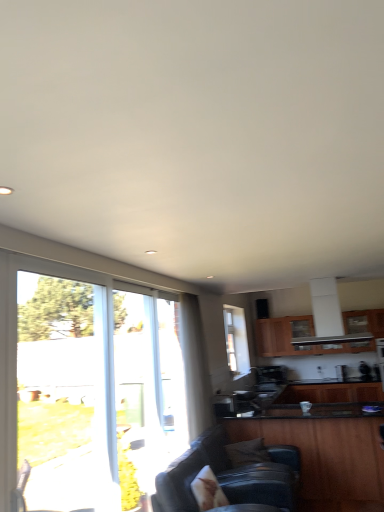
Question: From a real-world perspective, is clear glass window at left, acting as the 1th window starting from the front, below wooden cabinet at upper center, the first cabinetry viewed from the back?

Choices:
 (A) no
 (B) yes

Answer: (B)

Question: From the image's perspective, would you say clear glass window at left, placed as the 2th window when sorted from right to left, is shown under wooden cabinet at upper center, which is the third cabinetry from front to back?

Choices:
 (A) yes
 (B) no

Answer: (B)

Question: From a real-world perspective, is clear glass window at left, acting as the 1th window starting from the front, over wooden cabinet at upper center, which is the third cabinetry from front to back?

Choices:
 (A) yes
 (B) no

Answer: (B)

Question: Is clear glass window at left, placed as the 2th window when sorted from right to left, smaller than wooden cabinet at upper center, which is the third cabinetry from front to back?

Choices:
 (A) yes
 (B) no

Answer: (A)

Question: Does clear glass window at left, acting as the 1th window starting from the front, have a greater width compared to wooden cabinet at upper center, the first cabinetry viewed from the back?

Choices:
 (A) yes
 (B) no

Answer: (B)

Question: Is clear glass window at center, which is the 1th window from right to left, wider or thinner than clear glass window at left, acting as the 1th window starting from the front?

Choices:
 (A) thin
 (B) wide

Answer: (A)

Question: Is point (228, 368) positioned closer to the camera than point (100, 348)?

Choices:
 (A) closer
 (B) farther

Answer: (B)

Question: From the image's perspective, is clear glass window at center, marked as the 2th window in a front-to-back arrangement, located above or below clear glass window at left, acting as the 1th window starting from the front?

Choices:
 (A) below
 (B) above

Answer: (A)

Question: In terms of height, does clear glass window at center, which is the 1th window from right to left, look taller or shorter compared to clear glass window at left, the first window viewed from the left?

Choices:
 (A) tall
 (B) short

Answer: (B)

Question: Looking at the image, does wooden cabinet at lower right, which ranks as the third cabinetry in back-to-front order, seem bigger or smaller compared to wooden cabinet at lower right, which is the second cabinetry in front-to-back order?

Choices:
 (A) big
 (B) small

Answer: (A)

Question: Relative to wooden cabinet at lower right, the second cabinetry viewed from the back, is wooden cabinet at lower right, marked as the 1th cabinetry in a front-to-back arrangement, in front or behind?

Choices:
 (A) front
 (B) behind

Answer: (A)

Question: In terms of width, does wooden cabinet at lower right, marked as the 1th cabinetry in a front-to-back arrangement, look wider or thinner when compared to wooden cabinet at lower right, which is the second cabinetry in front-to-back order?

Choices:
 (A) wide
 (B) thin

Answer: (A)

Question: In the image, is wooden cabinet at lower right, marked as the 1th cabinetry in a front-to-back arrangement, on the left side or the right side of wooden cabinet at lower right, the second cabinetry viewed from the back?

Choices:
 (A) left
 (B) right

Answer: (A)

Question: Is point (235, 440) positioned closer to the camera than point (266, 325)?

Choices:
 (A) closer
 (B) farther

Answer: (A)

Question: Choose the correct answer: Is wooden cabinet at lower right, which ranks as the third cabinetry in back-to-front order, inside wooden cabinet at upper center, which is the third cabinetry from front to back, or outside it?

Choices:
 (A) inside
 (B) outside

Answer: (B)